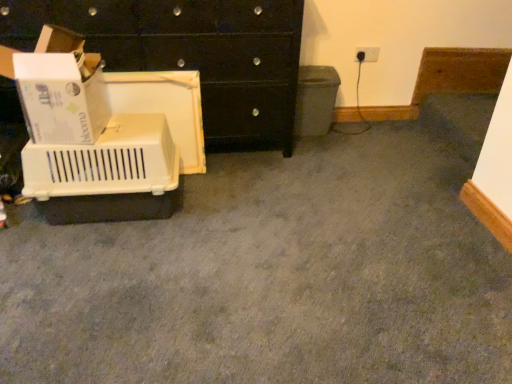
Question: Is matte gray recycling bin at center-right smaller than white plastic electric outlet at upper right?

Choices:
 (A) yes
 (B) no

Answer: (B)

Question: Is matte gray recycling bin at center-right facing away from white plastic electric outlet at upper right?

Choices:
 (A) yes
 (B) no

Answer: (B)

Question: Is matte gray recycling bin at center-right to the right of white plastic electric outlet at upper right from the viewer's perspective?

Choices:
 (A) yes
 (B) no

Answer: (B)

Question: Does matte gray recycling bin at center-right have a lesser width compared to white plastic electric outlet at upper right?

Choices:
 (A) no
 (B) yes

Answer: (A)

Question: Is the position of matte gray recycling bin at center-right more distant than that of white plastic electric outlet at upper right?

Choices:
 (A) yes
 (B) no

Answer: (B)

Question: Does matte gray recycling bin at center-right appear on the left side of white plastic electric outlet at upper right?

Choices:
 (A) no
 (B) yes

Answer: (B)

Question: From the image's perspective, would you say black glossy chest of drawers at upper left is positioned over matte gray recycling bin at center-right?

Choices:
 (A) no
 (B) yes

Answer: (B)

Question: Considering the relative sizes of black glossy chest of drawers at upper left and matte gray recycling bin at center-right in the image provided, is black glossy chest of drawers at upper left thinner than matte gray recycling bin at center-right?

Choices:
 (A) yes
 (B) no

Answer: (B)

Question: From a real-world perspective, is black glossy chest of drawers at upper left on top of matte gray recycling bin at center-right?

Choices:
 (A) no
 (B) yes

Answer: (B)

Question: Is black glossy chest of drawers at upper left further to the viewer compared to matte gray recycling bin at center-right?

Choices:
 (A) yes
 (B) no

Answer: (B)

Question: Would you say black glossy chest of drawers at upper left is a long distance from matte gray recycling bin at center-right?

Choices:
 (A) no
 (B) yes

Answer: (A)

Question: Does black glossy chest of drawers at upper left have a greater width compared to matte gray recycling bin at center-right?

Choices:
 (A) no
 (B) yes

Answer: (B)

Question: Can you confirm if beige plastic crate at left is smaller than white cardboard box at left?

Choices:
 (A) yes
 (B) no

Answer: (B)